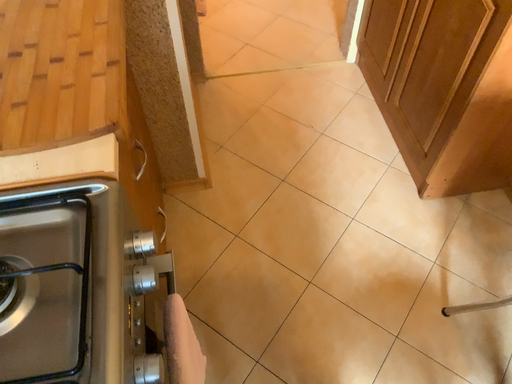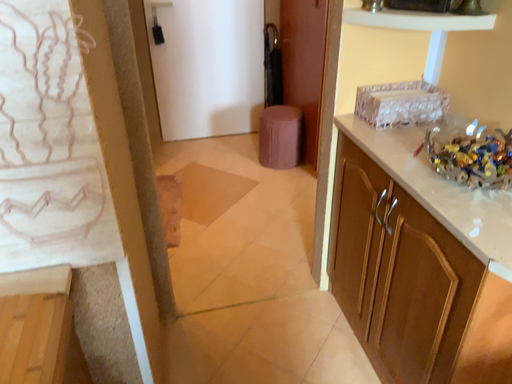
Question: Which way did the camera rotate in the video?

Choices:
 (A) rotated downward
 (B) rotated upward

Answer: (B)